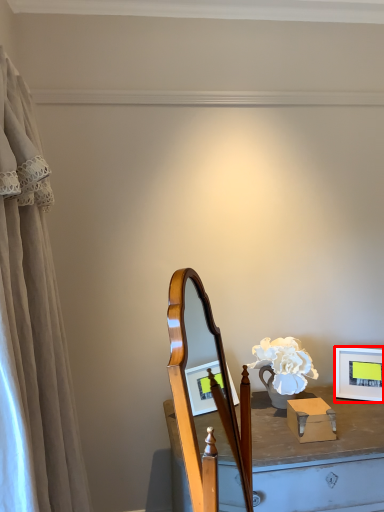
Question: From the image's perspective, where is picture frame (annotated by the red box) located in relation to curtain in the image?

Choices:
 (A) above
 (B) below

Answer: (B)